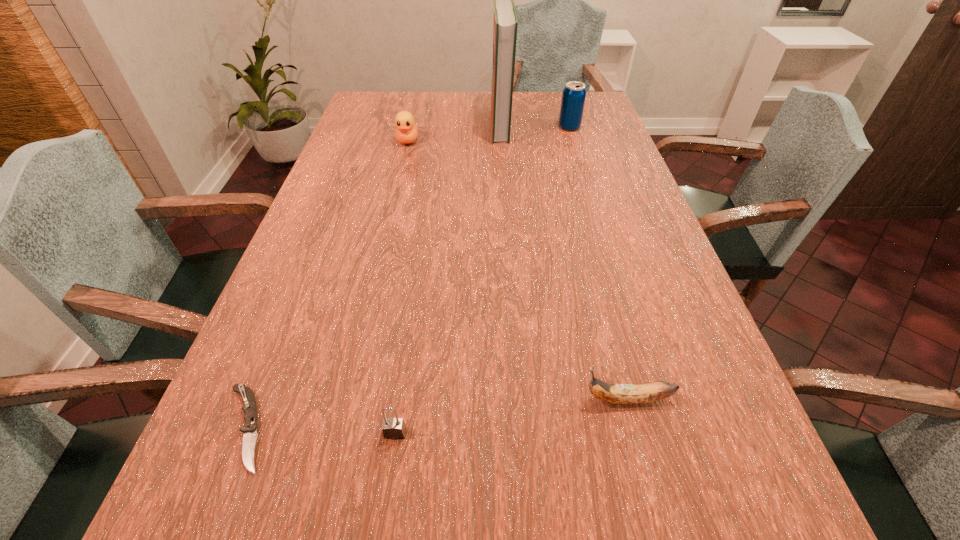
At what (x,y) coordinates should I click in order to perform the action: click on blank area in the image that satisfies the following two spatial constraints: 1. on the back side of the shortest object; 2. on the left side of the pop soda. Please return your answer as a coordinate pair (x, y). The height and width of the screenshot is (540, 960). Looking at the image, I should click on (365, 127).

Where is `free location that satisfies the following two spatial constraints: 1. on the cover of the hardback book; 2. on the back side of the fifth shortest object`? Image resolution: width=960 pixels, height=540 pixels. free location that satisfies the following two spatial constraints: 1. on the cover of the hardback book; 2. on the back side of the fifth shortest object is located at coordinates (500, 127).